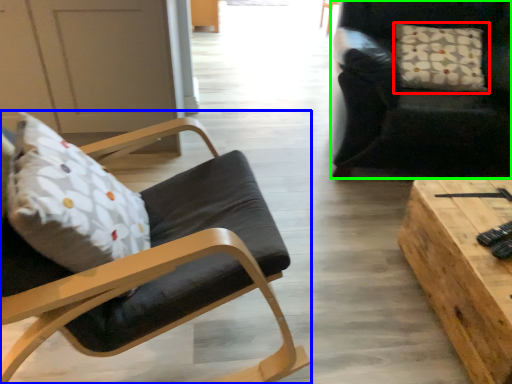
Question: Estimate the real-world distances between objects in this image. Which object is farther from pillow (highlighted by a red box), chair (highlighted by a blue box) or chair (highlighted by a green box)?

Choices:
 (A) chair
 (B) chair

Answer: (A)